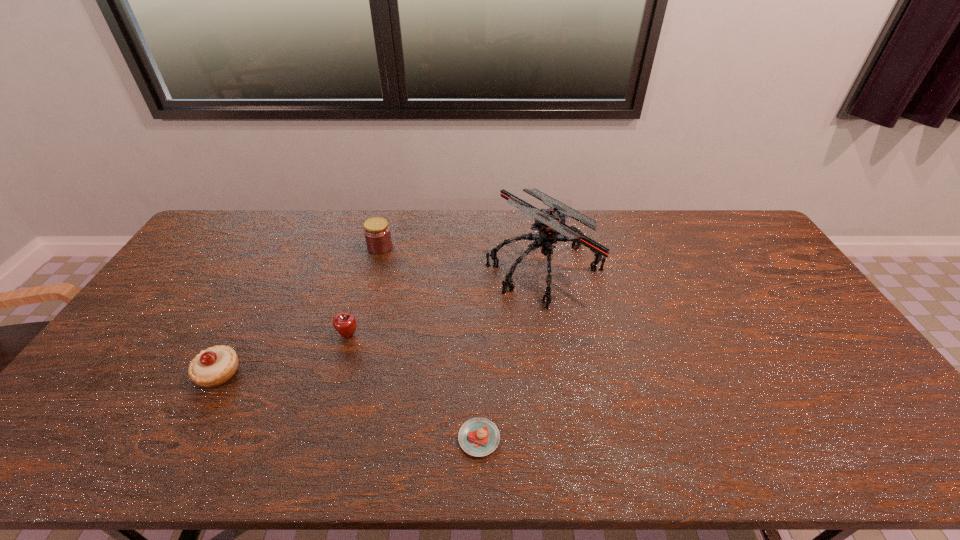
This screenshot has width=960, height=540. Find the location of `free point between the left pastry and the drone`. free point between the left pastry and the drone is located at coordinates (381, 320).

Where is `free spot between the apple and the jam`? The image size is (960, 540). free spot between the apple and the jam is located at coordinates (364, 291).

The width and height of the screenshot is (960, 540). Identify the location of free point between the taller pastry and the tallest object. (381, 320).

Locate an element on the screen. The width and height of the screenshot is (960, 540). blank region between the tallest object and the apple is located at coordinates pos(446,301).

The image size is (960, 540). In order to click on unoccupied position between the nearer pastry and the drone in this screenshot , I will do `click(512, 353)`.

Locate an element on the screen. The width and height of the screenshot is (960, 540). free space between the tallest object and the left pastry is located at coordinates (381, 320).

Locate an element on the screen. Image resolution: width=960 pixels, height=540 pixels. vacant space in between the second tallest object and the nearest object is located at coordinates (429, 342).

This screenshot has height=540, width=960. I want to click on vacant point located between the jam and the shorter pastry, so click(x=429, y=342).

The height and width of the screenshot is (540, 960). What are the coordinates of `free space between the fourth shortest object and the drone` in the screenshot? It's located at (462, 257).

Where is `vacant space that's between the fourth farthest object and the nearer pastry`? vacant space that's between the fourth farthest object and the nearer pastry is located at coordinates (348, 406).